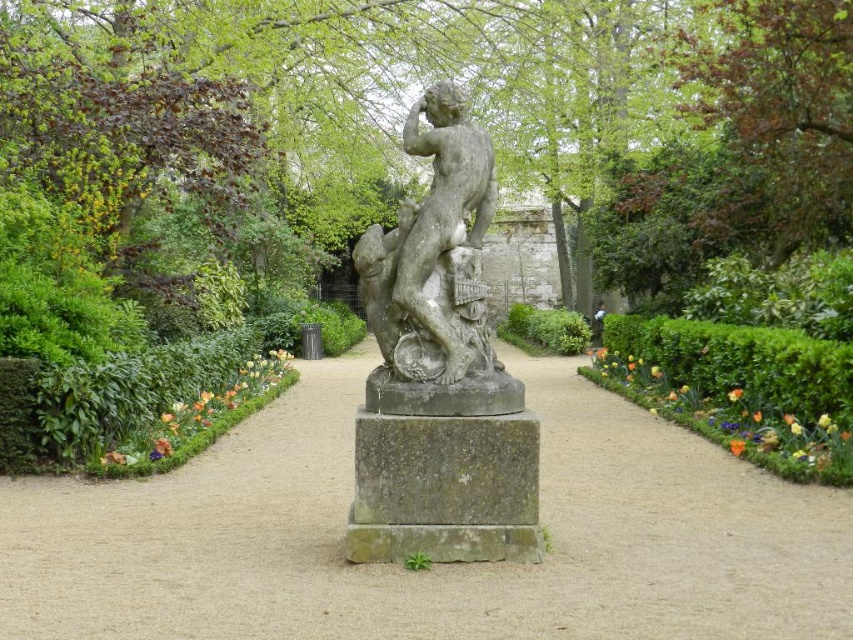
Measure the distance from gray stone path at center to gray stone statue at center.

gray stone path at center is 2.70 meters from gray stone statue at center.

Which is behind, point (807, 570) or point (445, 266)?

The point (445, 266) is behind.

Is point (558, 472) more distant than point (450, 396)?

That is True.

The image size is (853, 640). I want to click on gray stone path at center, so click(434, 564).